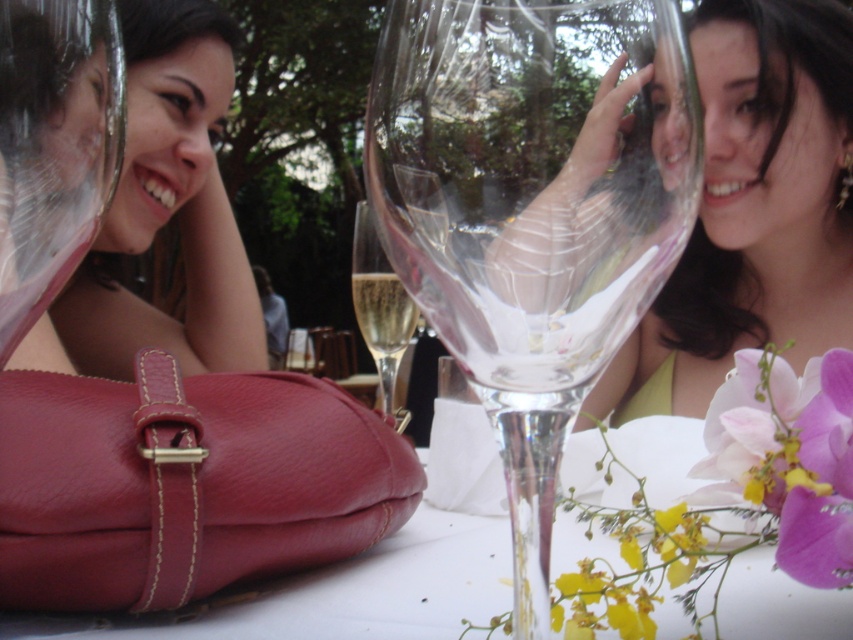
Consider the image. Which of these two, transparent glass wine glass at center or leather handbag at center, stands shorter?

Standing shorter between the two is leather handbag at center.

Is transparent glass wine glass at center smaller than leather handbag at center?

Yes.

Is point (602, 140) more distant than point (679, 486)?

No, it is in front of (679, 486).

Find the location of a particular element. The width and height of the screenshot is (853, 640). transparent glass wine glass at center is located at coordinates (532, 209).

Does matte black purse at lower left appear on the left side of clear glass wine glass at center?

Correct, you'll find matte black purse at lower left to the left of clear glass wine glass at center.

Does matte black purse at lower left appear under clear glass wine glass at center?

Incorrect, matte black purse at lower left is not positioned below clear glass wine glass at center.

Between point (119, 332) and point (370, 348), which one is positioned behind?

The point (119, 332) is more distant.

Locate an element on the screen. The height and width of the screenshot is (640, 853). matte black purse at lower left is located at coordinates (169, 205).

Is matte gold necklace at upper center smaller than pink silk flower at lower right?

Incorrect, matte gold necklace at upper center is not smaller in size than pink silk flower at lower right.

Is point (816, 288) more distant than point (830, 492)?

Yes, point (816, 288) is farther from viewer.

Where is `matte gold necklace at upper center`? Image resolution: width=853 pixels, height=640 pixels. matte gold necklace at upper center is located at coordinates (753, 209).